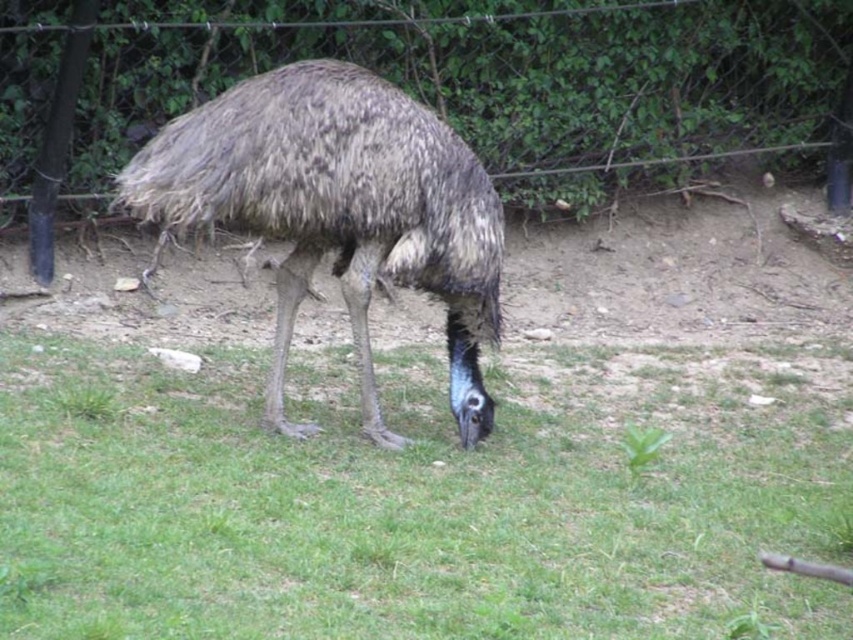
Between point (753, 500) and point (216, 22), which one is positioned behind?

The point (216, 22) is more distant.

Is point (137, 424) closer to viewer compared to point (524, 170)?

Yes.

Between point (587, 627) and point (798, 84), which one is positioned behind?

Positioned behind is point (798, 84).

At what (x,y) coordinates should I click in order to perform the action: click on green grass at center. Please return your answer as a coordinate pair (x, y). Looking at the image, I should click on (389, 513).

Which is more to the left, wire mesh at upper center or brown textured ostrich at center?

From the viewer's perspective, brown textured ostrich at center appears more on the left side.

What do you see at coordinates (506, 81) in the screenshot? I see `wire mesh at upper center` at bounding box center [506, 81].

This screenshot has height=640, width=853. Describe the element at coordinates (506, 81) in the screenshot. I see `wire mesh at upper center` at that location.

Where is `wire mesh at upper center`? The height and width of the screenshot is (640, 853). wire mesh at upper center is located at coordinates (506, 81).

Between green grass at center and brown textured ostrich at center, which one is positioned higher?

Positioned higher is brown textured ostrich at center.

Can you confirm if green grass at center is positioned above brown textured ostrich at center?

Incorrect, green grass at center is not positioned above brown textured ostrich at center.

Find the location of a particular element. green grass at center is located at coordinates (389, 513).

Image resolution: width=853 pixels, height=640 pixels. Find the location of `green grass at center`. green grass at center is located at coordinates (x=389, y=513).